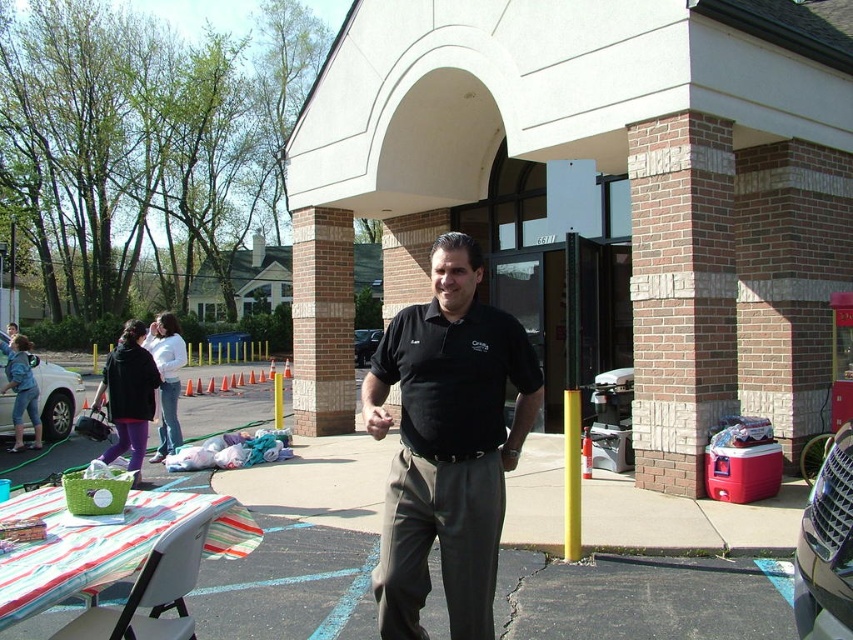
You are standing at the entrance of the building. You want to place a new cooler that is 1.5 meters tall. Where should you place it so that it doesn not block the view of the man in the foreground? Please provide coordinates in the format of point in the image. The current cooler is at point red cooler near the entrance of the building. The man in the foreground is at point point (631, 582). The distance from viewer to the man is 5.04 meters. The new cooler should be placed at least 0.5 meters away from 0

The new cooler should be placed at least 0.5 meters away from the man in the foreground to avoid blocking the view. Since the man is 5.04 meters away, placing the cooler between 5.54 meters and the man would ensure it doesn not obstruct the view. However, the exact coordinates depend on the image coordinate system. The current cooler is at the entrance, so placing the new cooler further back along the same line or to the side, maintaining the 0.5 meter clearance, would be appropriate.

You are a photographer at the community event. You want to take a photo of the black smooth shirt at center and the black matte car at center. Which object should you zoom in on to capture more details without moving the camera?

The black smooth shirt at center has a lesser width compared to the black matte car at center, so you should zoom in on the black smooth shirt at center to capture more details without moving the camera.